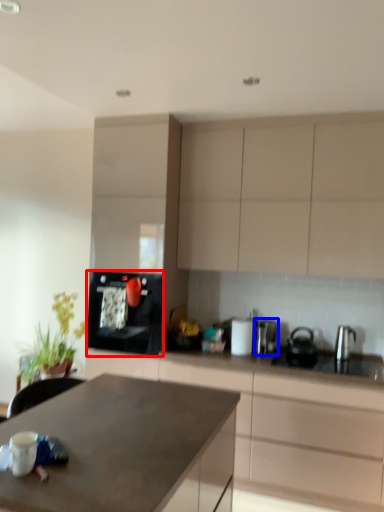
Question: Which point is closer to the camera, kitchen appliance (highlighted by a red box) or appliance (highlighted by a blue box)?

Choices:
 (A) kitchen appliance
 (B) appliance

Answer: (A)